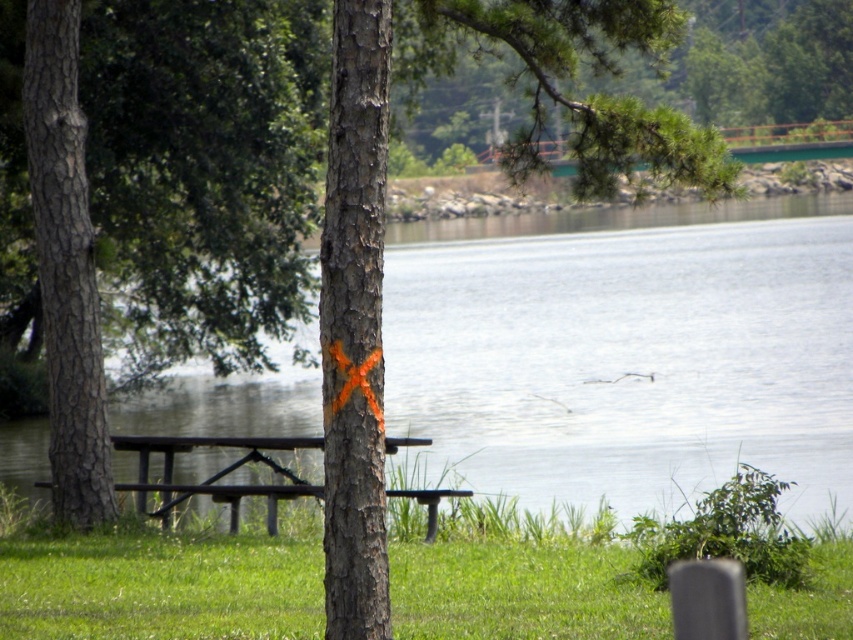
You are standing at the edge of the lake and want to reach the transparent water at center. According to the coordinates provided, in which direction should you move relative to your current position?

The transparent water at center is located at point coordinates, so you should move towards the center of the lake from your current position at the edge.

You are standing at the lakeside and want to place a small boat in the transparent water at center. However, you notice the brown wooden picnic table at center is in the way. Can you place the boat there without moving the picnic table?

The transparent water at center is above the brown wooden picnic table at center, meaning the water is located above the picnic table. Therefore, you can place the boat in the transparent water at center without moving the picnic table because the water is positioned above it.